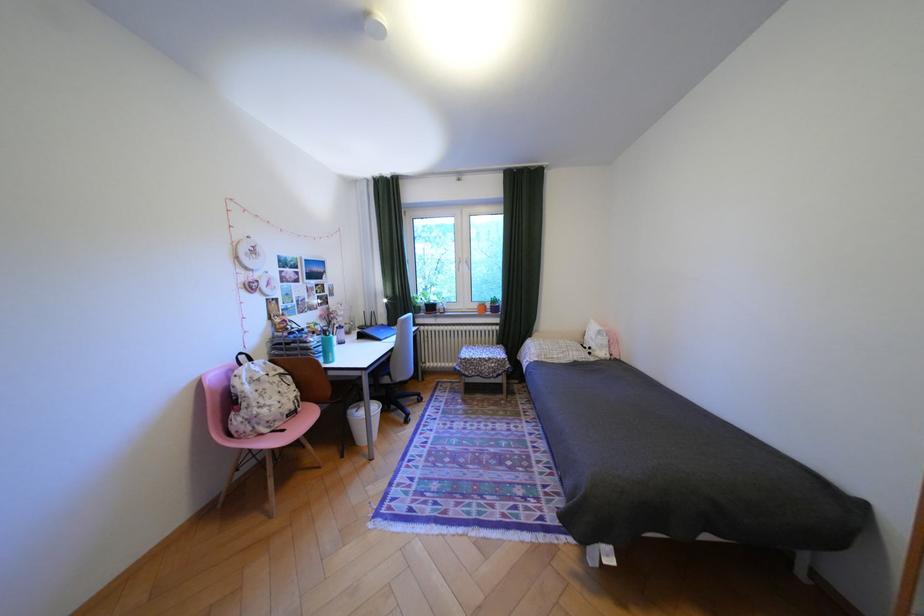
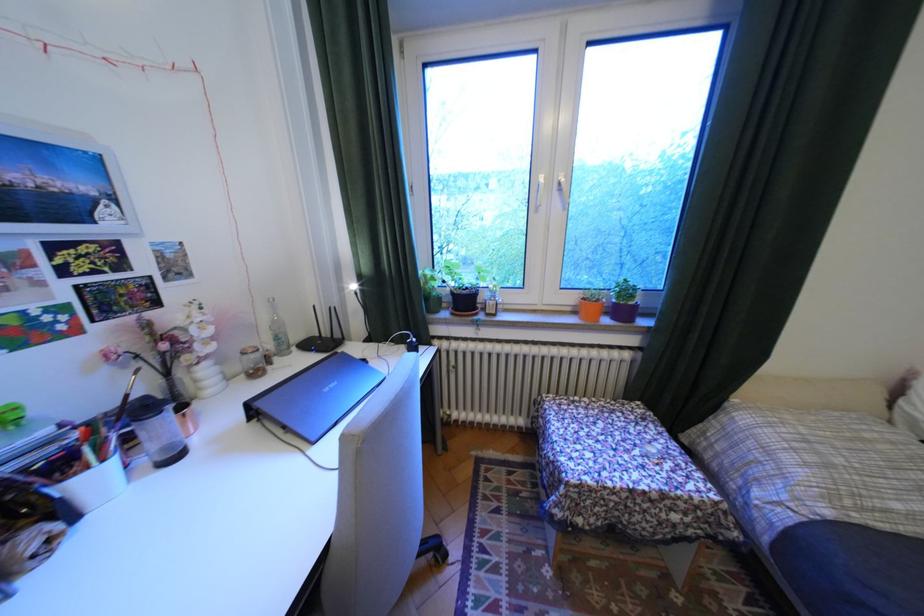
Question: The images are taken continuously from a first-person perspective. In which direction are you moving?

Choices:
 (A) Left
 (B) Right
 (C) Forward
 (D) Backward

Answer: (C)